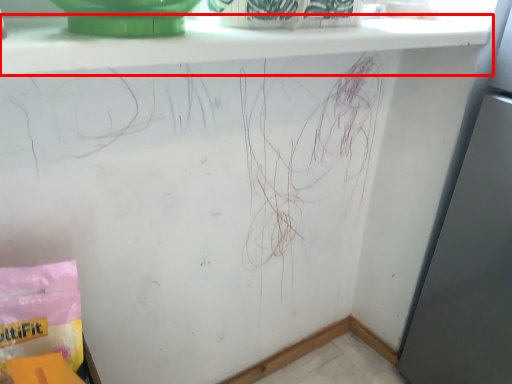
Question: From the image's perspective, what is the correct spatial positioning of window sill (annotated by the red box) in reference to material?

Choices:
 (A) above
 (B) below

Answer: (A)